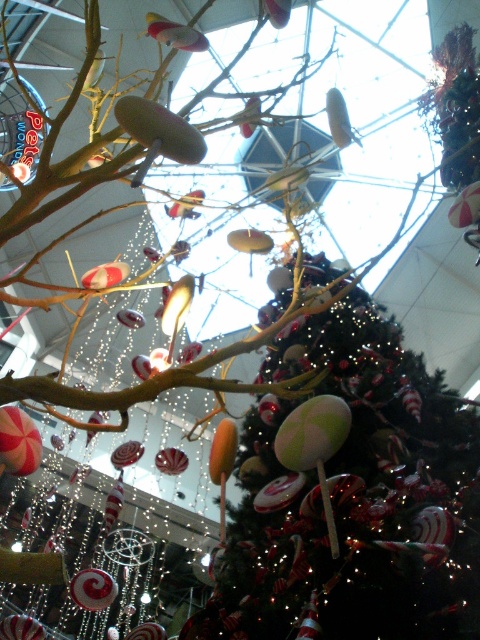
Which is more to the right, shiny green ball at center or shiny red lollipop at lower left?

Positioned to the right is shiny green ball at center.

Is shiny green ball at center bigger than shiny red lollipop at lower left?

Yes.

Who is more distant from viewer, (x=307, y=515) or (x=84, y=584)?

Positioned behind is point (x=84, y=584).

What are the coordinates of `shiny green ball at center` in the screenshot? It's located at (351, 493).